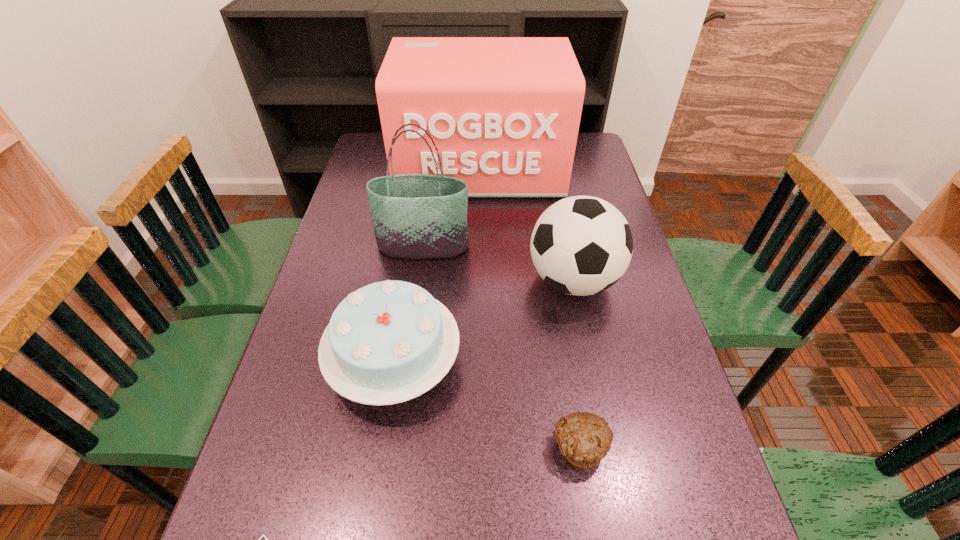
This screenshot has width=960, height=540. I want to click on box, so click(x=504, y=112).

I want to click on tote bag, so click(x=415, y=216).

Find the location of a particular element. This screenshot has width=960, height=540. soccer ball is located at coordinates (581, 245).

The height and width of the screenshot is (540, 960). What are the coordinates of `the third shortest object` in the screenshot? It's located at (388, 342).

The image size is (960, 540). What are the coordinates of `the second shortest object` in the screenshot? It's located at (584, 439).

This screenshot has height=540, width=960. Find the location of `free space located 0.380m on the surface of the farthest object where the text is embossed`. free space located 0.380m on the surface of the farthest object where the text is embossed is located at coordinates pos(481,290).

Where is `vacant space located 0.100m on the right of the tote bag`? The width and height of the screenshot is (960, 540). vacant space located 0.100m on the right of the tote bag is located at coordinates (504, 247).

The height and width of the screenshot is (540, 960). In order to click on vacant space located 0.080m on the left of the soccer ball in this screenshot , I will do `click(497, 280)`.

Identify the location of vacant space located 0.330m on the right of the fourth tallest object. (606, 361).

At what (x,y) coordinates should I click in order to perform the action: click on free space located on the left of the muffin. Please return your answer as a coordinate pair (x, y). This screenshot has height=540, width=960. Looking at the image, I should click on (398, 447).